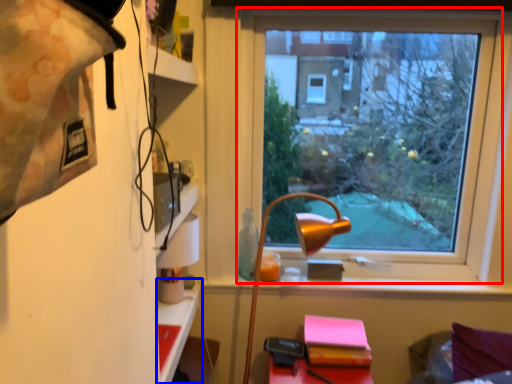
Question: Which object appears farthest to the camera in this image, window (highlighted by a red box) or table (highlighted by a blue box)?

Choices:
 (A) window
 (B) table

Answer: (A)